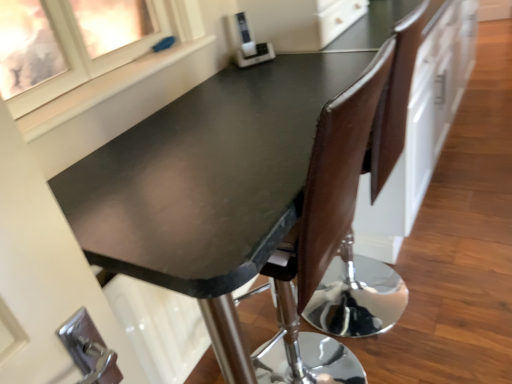
You are a GUI agent. You are given a task and a screenshot of the screen. Output one action in this format:
    pyautogui.click(x=<x>, y=<y>)
    Task: Click on the vacant area that is in front of white plastic appliance at upper center
    This screenshot has width=512, height=384.
    Given the screenshot: What is the action you would take?
    pyautogui.click(x=261, y=79)